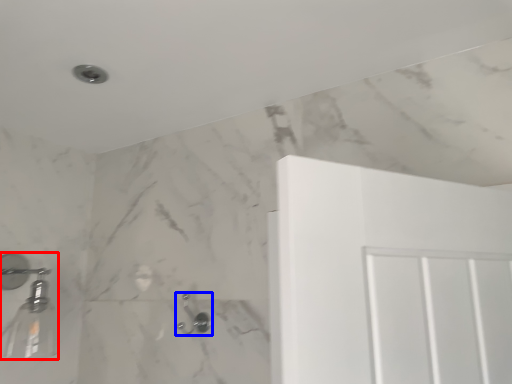
Question: Among these objects, which one is farthest to the camera, shower (highlighted by a red box) or shower (highlighted by a blue box)?

Choices:
 (A) shower
 (B) shower

Answer: (B)